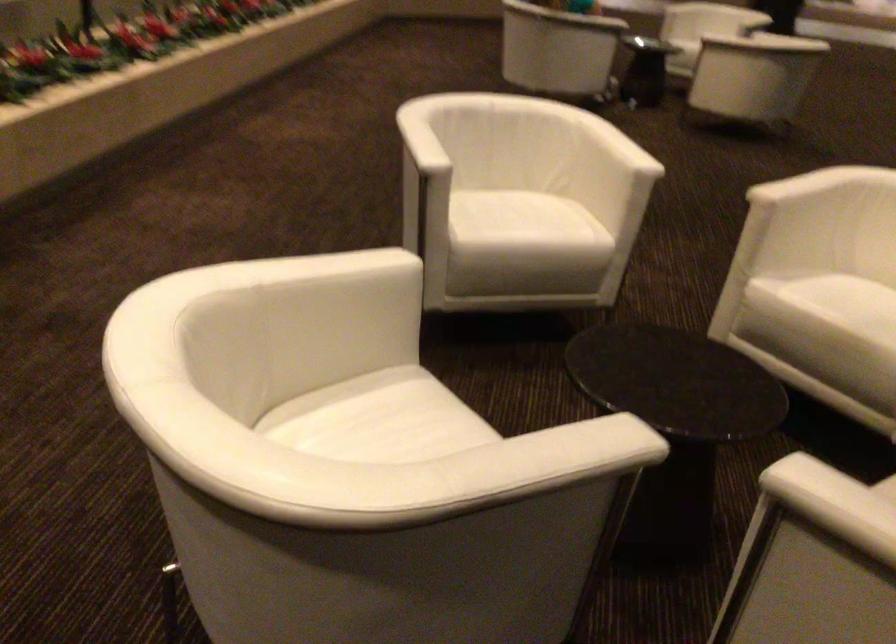
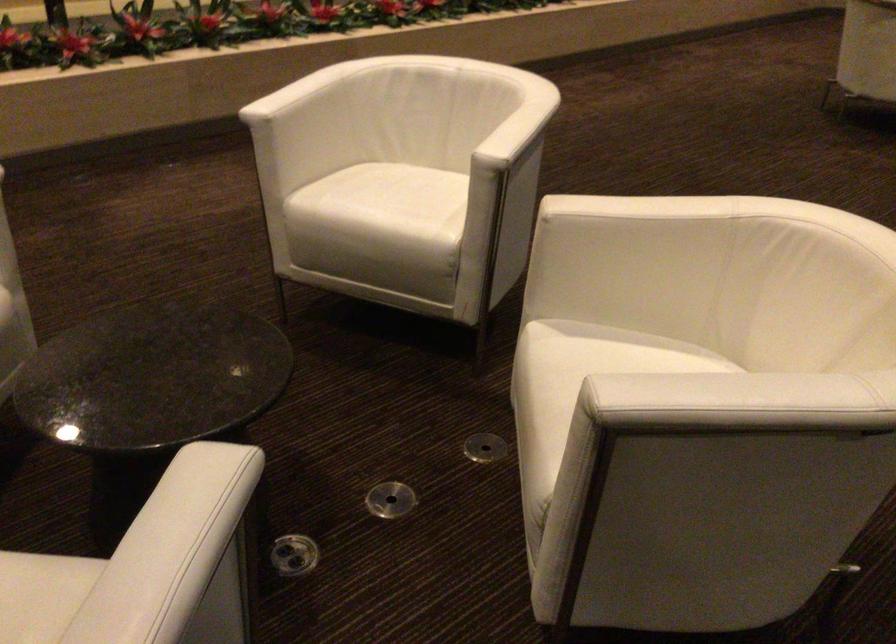
Where in the second image is the point corresponding to point 632,138 from the first image?

(515, 122)